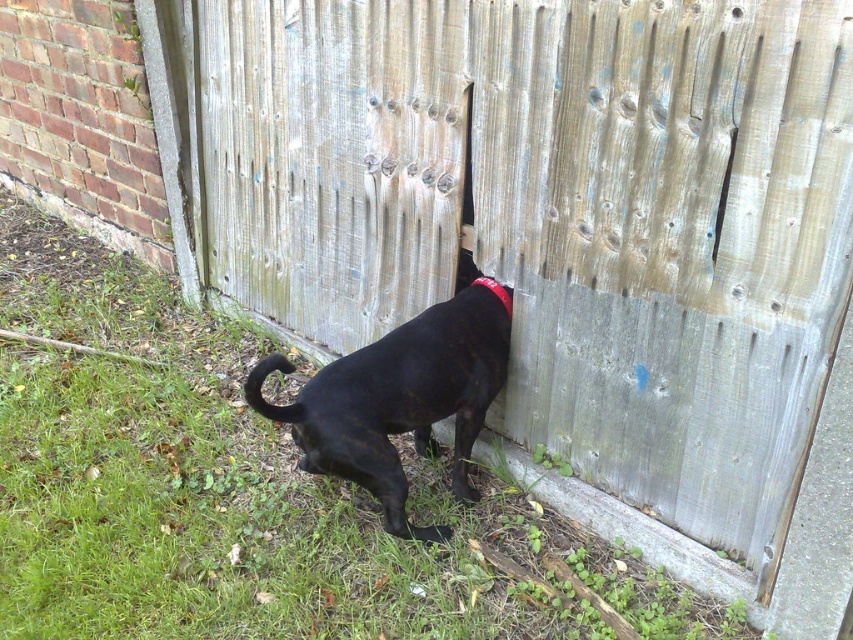
You are standing 10 feet away from the camera. The black matte dog at center is in your line of sight. Can you see the dog clearly?

The black matte dog at center is 5.47 feet away from the camera. Since you are standing 10 feet away from the camera, the dog is within your line of sight and should be visible clearly.

You are a photographer setting up for a pet photo shoot. You have a camera with a 20cm wide frame. The black matte dog at center and the red fabric neckband at center are in your shot. Can the dog and neckband fit side by side within the frame without overlapping?

The black matte dog at center might be wider than red fabric neckband at center, so there is uncertainty if they can fit side by side within the 20cm frame without overlapping. Measure their combined width first.